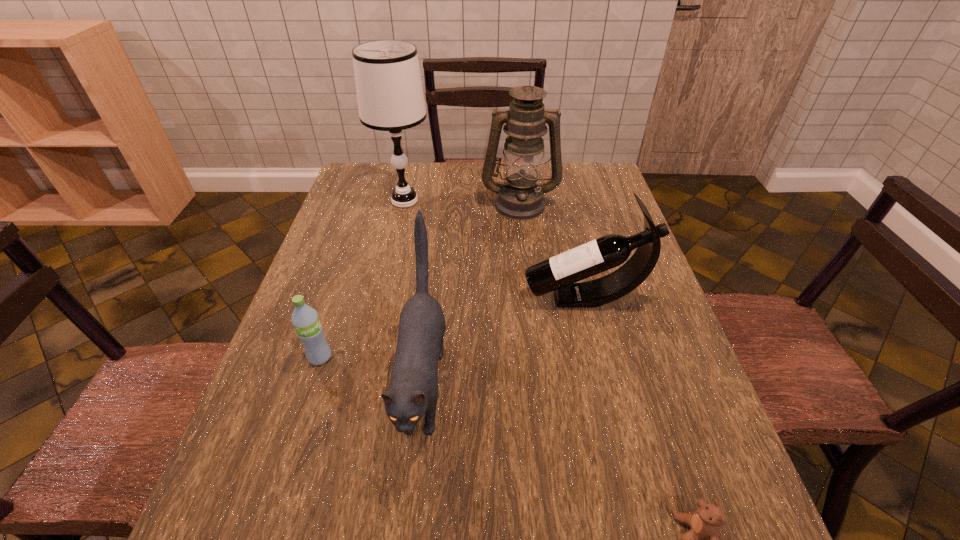
Locate an element on the screen. vacant space situated on the stand of the fourth nearest object is located at coordinates (366, 298).

What are the coordinates of `free location located 0.170m on the right of the fifth tallest object` in the screenshot? It's located at (410, 357).

In order to click on table lamp located in the far edge section of the desktop in this screenshot , I will do [x=390, y=96].

Where is `oil lamp at the far edge`? The height and width of the screenshot is (540, 960). oil lamp at the far edge is located at coordinates (520, 198).

This screenshot has height=540, width=960. I want to click on table lamp situated at the left edge, so click(390, 96).

The height and width of the screenshot is (540, 960). I want to click on water bottle present at the left edge, so click(x=309, y=330).

The height and width of the screenshot is (540, 960). I want to click on object at the right edge, so click(560, 273).

Locate an element on the screen. object that is at the far left corner is located at coordinates (390, 96).

This screenshot has height=540, width=960. I want to click on free region at the far edge, so click(x=444, y=179).

At what (x,y) coordinates should I click in order to perform the action: click on free space at the left edge. Please return your answer as a coordinate pair (x, y). Looking at the image, I should click on (353, 240).